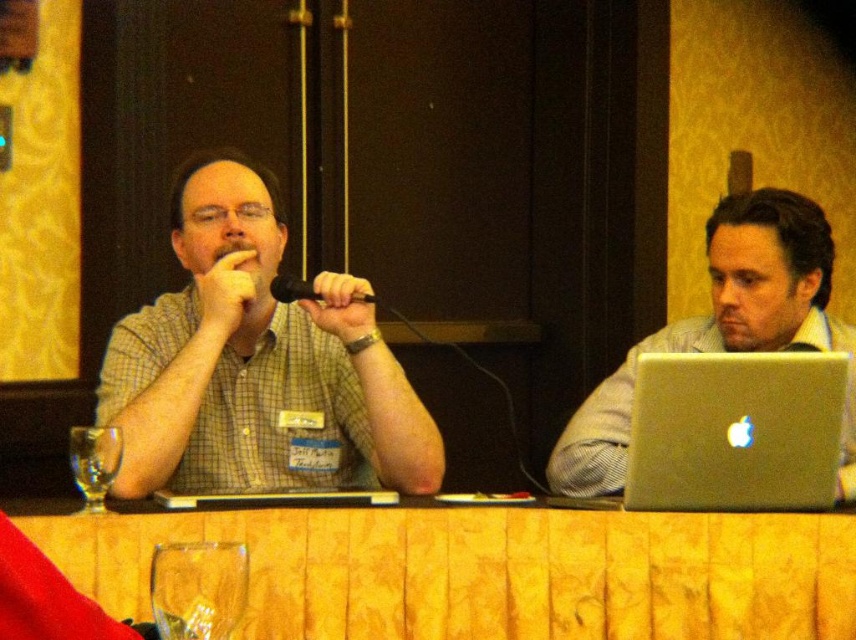
Question: Among these points, which one is farthest from the camera?

Choices:
 (A) (229, 477)
 (B) (696, 342)
 (C) (835, 445)

Answer: (B)

Question: Is silver metallic laptop at right further to the viewer compared to transparent glass at lower left?

Choices:
 (A) yes
 (B) no

Answer: (A)

Question: Can you confirm if green checkered shirt at center is positioned to the right of silver metallic laptop at center?

Choices:
 (A) yes
 (B) no

Answer: (B)

Question: Is silver metallic laptop at center positioned before transparent glass at lower left?

Choices:
 (A) yes
 (B) no

Answer: (B)

Question: Which is nearer to the silver metallic laptop at right?

Choices:
 (A) transparent glass at lower left
 (B) clear glass wine glass at lower left
 (C) yellow fabric table at center
 (D) green checkered shirt at center

Answer: (C)

Question: Estimate the real-world distances between objects in this image. Which object is farther from the yellow fabric table at center?

Choices:
 (A) clear glass wine glass at lower left
 (B) silver metallic laptop at right
 (C) silver metallic laptop at center
 (D) transparent glass at lower left

Answer: (A)